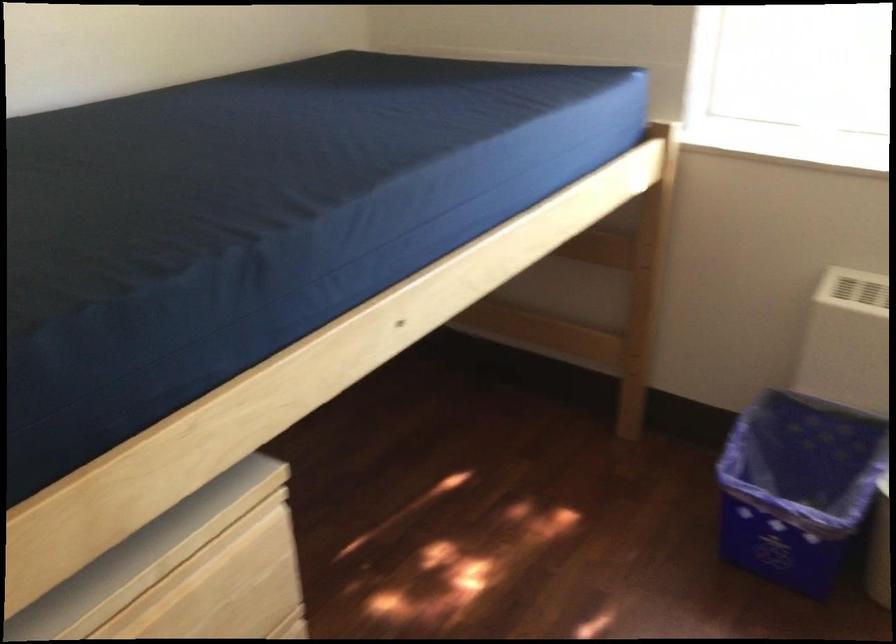
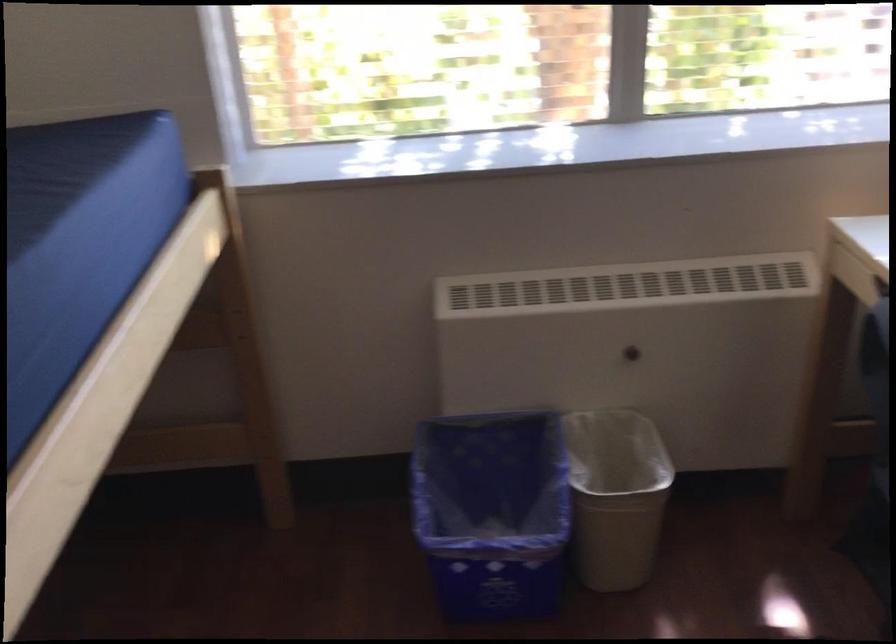
Locate, in the second image, the point that corresponds to point 807,495 in the first image.

(492, 512)